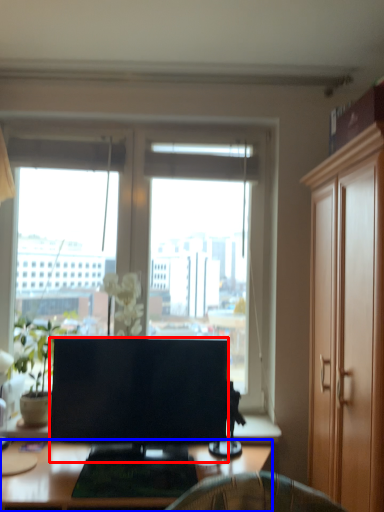
Question: Among these objects, which one is nearest to the camera, television (highlighted by a red box) or desk (highlighted by a blue box)?

Choices:
 (A) television
 (B) desk

Answer: (B)